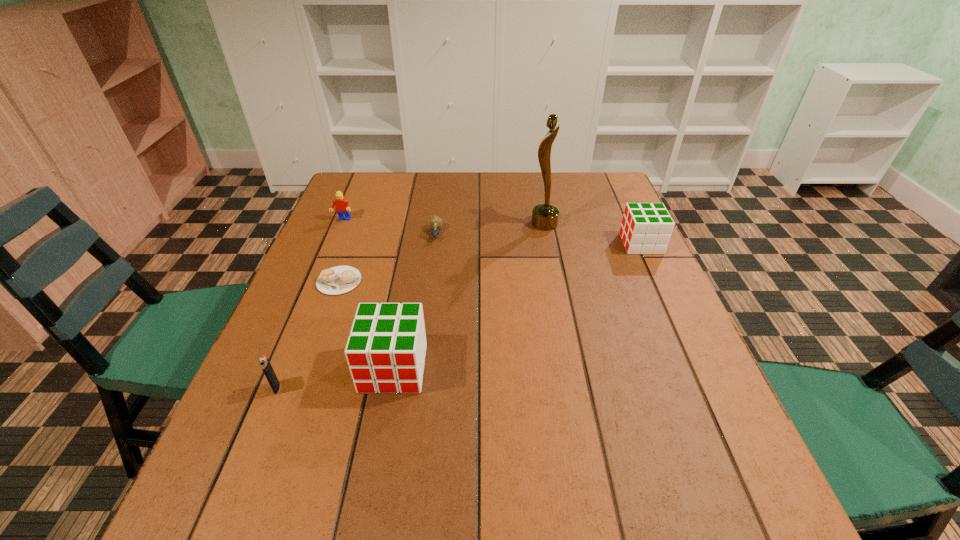
Identify the location of vacant region that satisfies the following two spatial constraints: 1. on the front-facing side of the fifth farthest object; 2. on the left side of the Lego. (318, 281).

I want to click on blank space that satisfies the following two spatial constraints: 1. on the front-facing side of the Lego; 2. on the right side of the igniter, so click(273, 388).